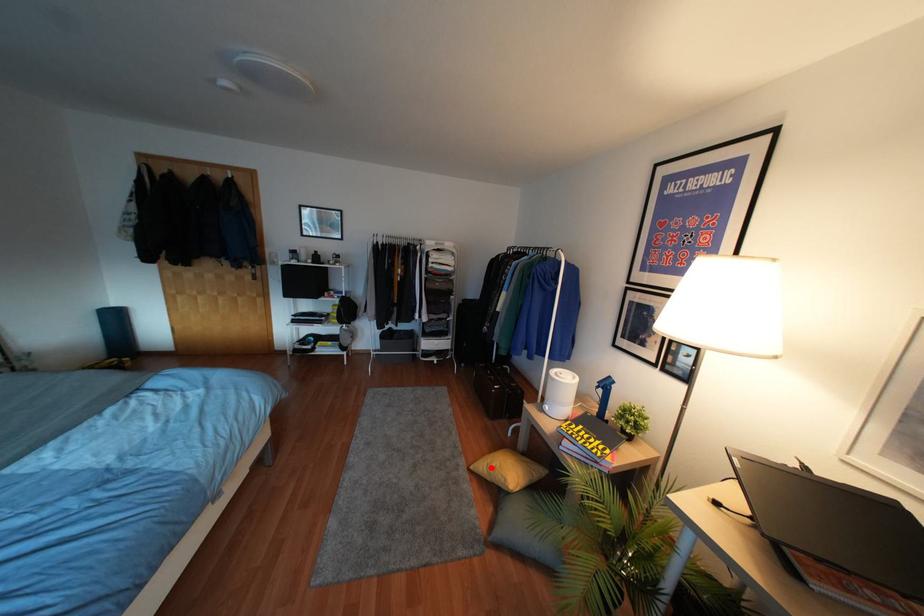
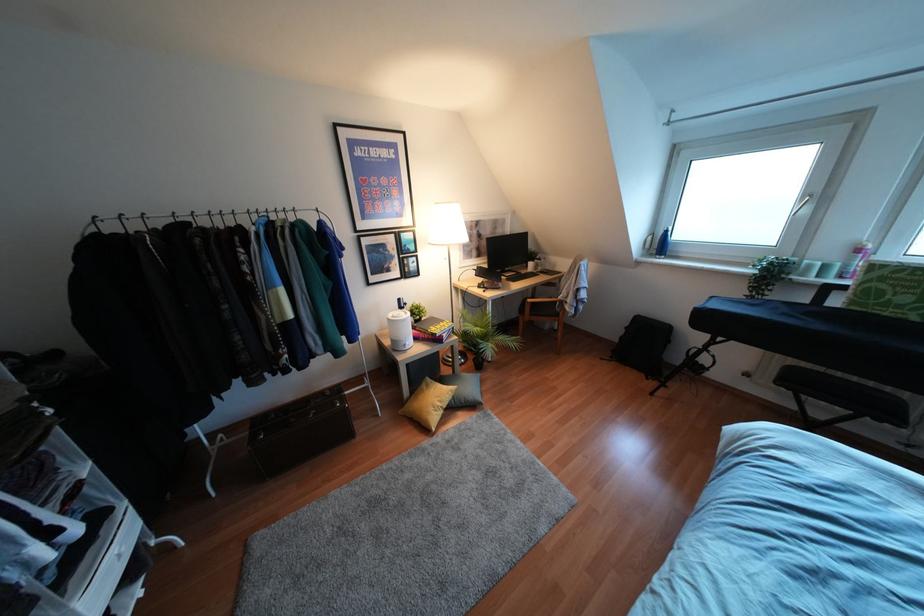
The point at the highlighted location is marked in the first image. Where is the corresponding point in the second image?

(439, 403)